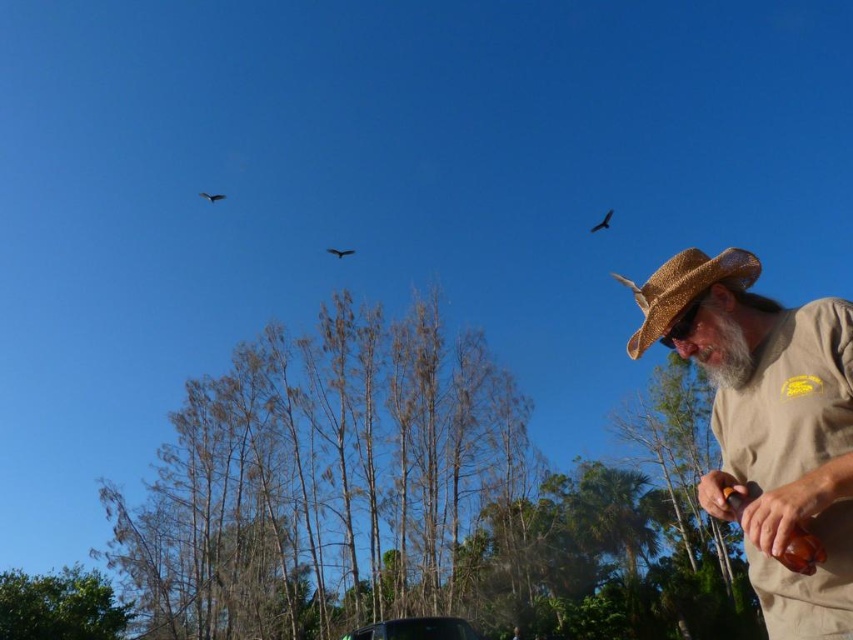
The height and width of the screenshot is (640, 853). What are the coordinates of `dark brown feathers at upper right` in the screenshot? It's located at (602, 221).

Who is higher up, dark brown feathers at upper right or dark brown feathers at upper left?

dark brown feathers at upper left is higher up.

What do you see at coordinates (602, 221) in the screenshot? The width and height of the screenshot is (853, 640). I see `dark brown feathers at upper right` at bounding box center [602, 221].

This screenshot has width=853, height=640. What are the coordinates of `dark brown feathers at upper right` in the screenshot? It's located at (602, 221).

Who is taller, tan straw hat at right or straw hat at right?

tan straw hat at right is taller.

Can you confirm if tan straw hat at right is positioned to the right of straw hat at right?

Indeed, tan straw hat at right is positioned on the right side of straw hat at right.

Does point (811, 310) lie behind point (691, 289)?

No, (811, 310) is in front of (691, 289).

Locate an element on the screen. The image size is (853, 640). tan straw hat at right is located at coordinates (769, 422).

Is point (799, 433) farther from viewer compared to point (202, 195)?

No, (799, 433) is closer to viewer.

Who is positioned more to the right, tan straw hat at right or dark brown feathers at upper left?

From the viewer's perspective, tan straw hat at right appears more on the right side.

Who is more distant from viewer, (822, 637) or (213, 196)?

The point (213, 196) is more distant.

Where is `tan straw hat at right`? This screenshot has width=853, height=640. tan straw hat at right is located at coordinates (769, 422).